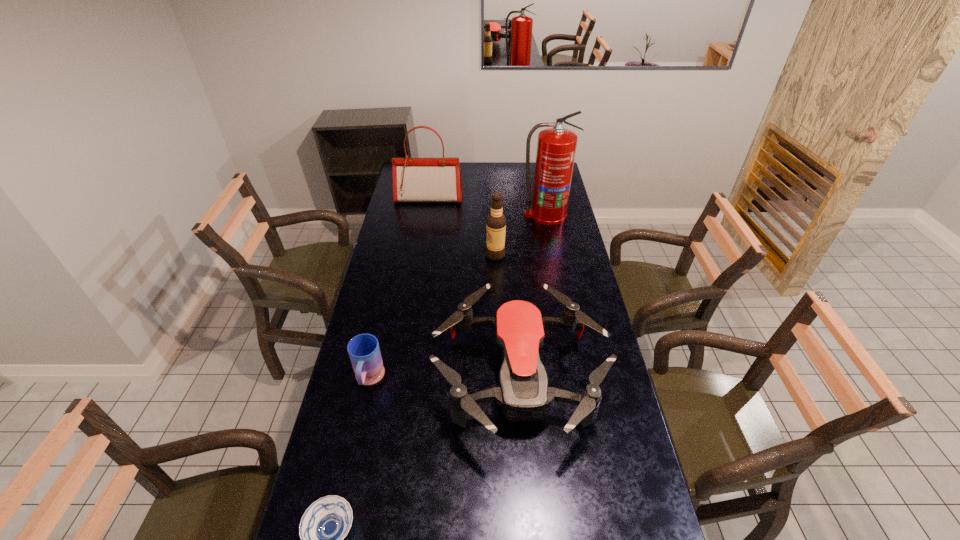
Find the location of a particular element. free space located on the label of the fourth shortest object is located at coordinates (456, 255).

The image size is (960, 540). I want to click on vacant area situated on the label of the fourth shortest object, so click(420, 255).

Find the location of a particular element. vacant position located on the label of the fourth shortest object is located at coordinates (425, 255).

Locate an element on the screen. This screenshot has width=960, height=540. vacant space located on the camera side of the fourth tallest object is located at coordinates (527, 481).

I want to click on free region located 0.130m on the side of the fifth tallest object with the handle, so click(356, 436).

Locate an element on the screen. handbag that is at the left edge is located at coordinates (414, 179).

Where is `mug situated at the left edge`? This screenshot has height=540, width=960. mug situated at the left edge is located at coordinates (364, 351).

Where is `fire extinguisher located in the right edge section of the desktop`? The image size is (960, 540). fire extinguisher located in the right edge section of the desktop is located at coordinates (556, 147).

Identify the location of drone that is at the right edge. The width and height of the screenshot is (960, 540). (523, 392).

The image size is (960, 540). In the image, there is a desktop. What are the coordinates of `vacant space at the far edge` in the screenshot? It's located at (530, 176).